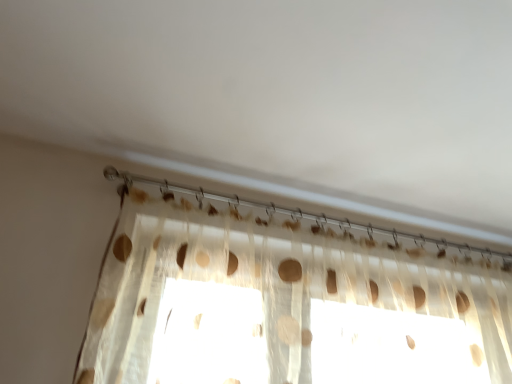
Locate an element on the screen. translucent fabric curtain at upper center is located at coordinates (287, 303).

Describe the element at coordinates (287, 303) in the screenshot. I see `translucent fabric curtain at upper center` at that location.

Where is `translucent fabric at upper center`? translucent fabric at upper center is located at coordinates (286, 210).

This screenshot has width=512, height=384. Describe the element at coordinates (286, 210) in the screenshot. I see `translucent fabric at upper center` at that location.

Where is `translucent fabric curtain at upper center`? This screenshot has width=512, height=384. translucent fabric curtain at upper center is located at coordinates (287, 303).

Is translucent fabric at upper center at the right side of translucent fabric curtain at upper center?

No.

Consider the image. Does translucent fabric at upper center lie behind translucent fabric curtain at upper center?

Yes, the depth of translucent fabric at upper center is greater than that of translucent fabric curtain at upper center.

Considering the positions of points (366, 225) and (405, 347), is point (366, 225) farther from camera compared to point (405, 347)?

Yes, point (366, 225) is farther from viewer.

From the image's perspective, is translucent fabric at upper center located above or below translucent fabric curtain at upper center?

translucent fabric at upper center is above translucent fabric curtain at upper center.

From a real-world perspective, which is physically below, translucent fabric at upper center or translucent fabric curtain at upper center?

From a 3D spatial view, translucent fabric curtain at upper center is below.

Can you confirm if translucent fabric at upper center is thinner than translucent fabric curtain at upper center?

Correct, the width of translucent fabric at upper center is less than that of translucent fabric curtain at upper center.

Between translucent fabric at upper center and translucent fabric curtain at upper center, which one has more height?

translucent fabric curtain at upper center is taller.

Who is bigger, translucent fabric at upper center or translucent fabric curtain at upper center?

translucent fabric curtain at upper center is bigger.

Is translucent fabric at upper center outside of translucent fabric curtain at upper center?

That's incorrect, translucent fabric at upper center is not completely outside translucent fabric curtain at upper center.

Is there a large distance between translucent fabric at upper center and translucent fabric curtain at upper center?

That's not correct — translucent fabric at upper center is a little close to translucent fabric curtain at upper center.

Is translucent fabric at upper center facing towards translucent fabric curtain at upper center?

Yes, translucent fabric at upper center is oriented towards translucent fabric curtain at upper center.

Can you tell me how much translucent fabric at upper center and translucent fabric curtain at upper center differ in facing direction?

They differ by 4.21e-05 degrees in their facing directions.

How much distance is there between translucent fabric at upper center and translucent fabric curtain at upper center?

They are 28.61 centimeters apart.

Where is `clothesline located behind the translucent fabric curtain at upper center`? This screenshot has width=512, height=384. clothesline located behind the translucent fabric curtain at upper center is located at coordinates (286, 210).

Does translucent fabric curtain at upper center appear on the right side of translucent fabric at upper center?

Correct, you'll find translucent fabric curtain at upper center to the right of translucent fabric at upper center.

Which object is closer to the camera taking this photo, translucent fabric curtain at upper center or translucent fabric at upper center?

translucent fabric curtain at upper center is closer to the camera.

Considering the points (129, 315) and (165, 181), which point is behind, point (129, 315) or point (165, 181)?

The point (165, 181) is more distant.

From the image's perspective, does translucent fabric curtain at upper center appear lower than translucent fabric at upper center?

Yes.

From a real-world perspective, is translucent fabric curtain at upper center on top of translucent fabric at upper center?

Incorrect, from a real-world perspective, translucent fabric curtain at upper center is lower than translucent fabric at upper center.

Does translucent fabric curtain at upper center have a lesser width compared to translucent fabric at upper center?

No, translucent fabric curtain at upper center is not thinner than translucent fabric at upper center.

Based on the photo, is translucent fabric curtain at upper center taller than translucent fabric at upper center?

Yes, translucent fabric curtain at upper center is taller than translucent fabric at upper center.

Considering the sizes of objects translucent fabric curtain at upper center and translucent fabric at upper center in the image provided, who is bigger, translucent fabric curtain at upper center or translucent fabric at upper center?

Bigger between the two is translucent fabric curtain at upper center.

Choose the correct answer: Is translucent fabric curtain at upper center inside translucent fabric at upper center or outside it?

The correct answer is: outside.

Would you say translucent fabric curtain at upper center is a long distance from translucent fabric at upper center?

A: Actually, translucent fabric curtain at upper center and translucent fabric at upper center are a little close together.

Is translucent fabric curtain at upper center oriented towards translucent fabric at upper center?

Yes, translucent fabric curtain at upper center is oriented towards translucent fabric at upper center.

Find the location of a particular element. curtain below the translucent fabric at upper center (from the image's perspective) is located at coordinates (287, 303).

This screenshot has width=512, height=384. What are the coordinates of `clothesline positioned vertically above the translucent fabric curtain at upper center (from a real-world perspective)` in the screenshot? It's located at (286, 210).

The width and height of the screenshot is (512, 384). Find the location of `curtain in front of the translucent fabric at upper center`. curtain in front of the translucent fabric at upper center is located at coordinates (287, 303).